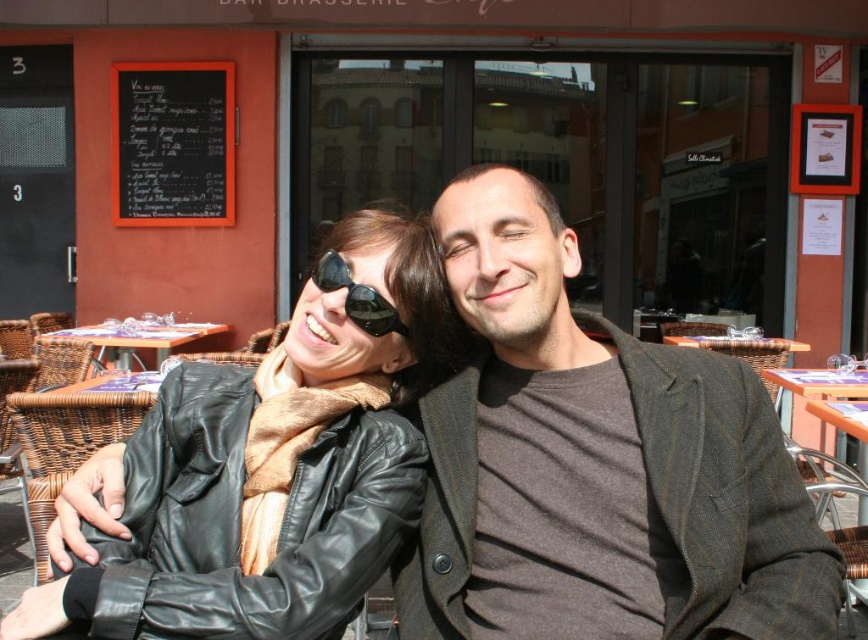
Does black chalkboard at upper left have a greater height compared to wooden table at center?

Correct, black chalkboard at upper left is much taller as wooden table at center.

Does black chalkboard at upper left have a lesser width compared to wooden table at center?

Incorrect, black chalkboard at upper left's width is not less than wooden table at center's.

Image resolution: width=868 pixels, height=640 pixels. I want to click on black chalkboard at upper left, so click(172, 144).

Which is in front, point (229, 493) or point (337, 260)?

Point (229, 493) is in front.

Which is more to the right, black leather jacket at center or black reflective sunglasses at center?

Positioned to the right is black reflective sunglasses at center.

Who is more forward, (183, 612) or (329, 272)?

Point (183, 612) is in front.

Locate an element on the screen. black leather jacket at center is located at coordinates [x=281, y=460].

Does brown pinstripe blazer at center appear under wooden table at center?

Indeed, brown pinstripe blazer at center is positioned under wooden table at center.

Does point (563, 531) come behind point (129, 326)?

No, it is in front of (129, 326).

What do you see at coordinates (596, 465) in the screenshot? I see `brown pinstripe blazer at center` at bounding box center [596, 465].

Identify the location of brown pinstripe blazer at center. (596, 465).